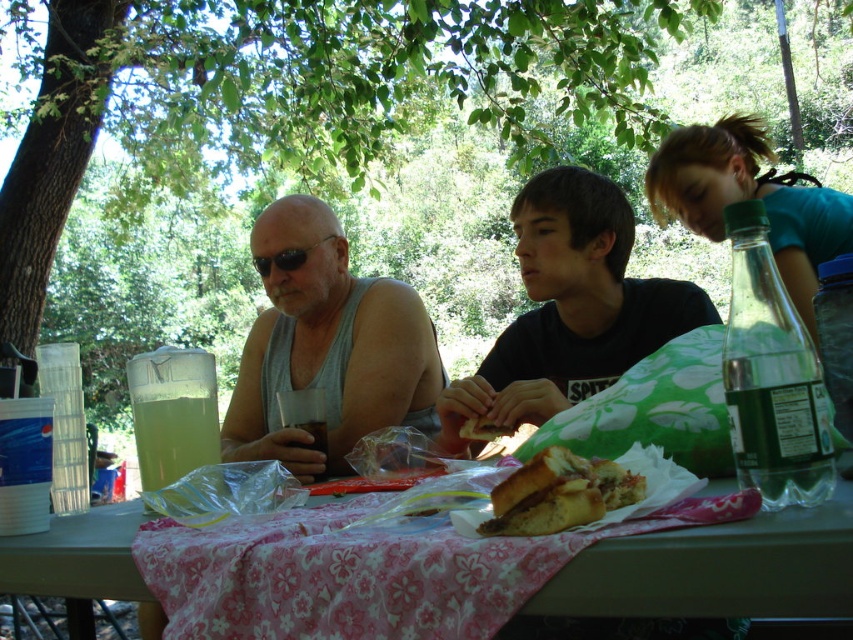
You are standing at the point marked by coordinates point at (138, 458). You want to place a new item exactly halfway between them. Where should you place it?

The point halfway between them would be at the midpoint of the coordinates, so you should place the item at the midpoint between point at (138, 458).

You are setting up a small stand to sell drinks at a picnic area. You have a limited space on the counter. You need to place both the translucent plastic cup at table left and the black plastic sunglasses at left. Which item should you choose to place first if you want to ensure both items can fit on the counter without overlapping?

The translucent plastic cup at table left occupies less space than the black plastic sunglasses at left, so you should place the black plastic sunglasses at left first to ensure both items can fit on the counter without overlapping.

You are setting up a picnic and want to place the brown bread sandwich at center and the translucent plastic cup at center on the table. Based on their heights, which item should you place first to ensure stability?

The brown bread sandwich at center has a lesser height compared to the translucent plastic cup at center, so you should place the translucent plastic cup at center first to ensure stability.